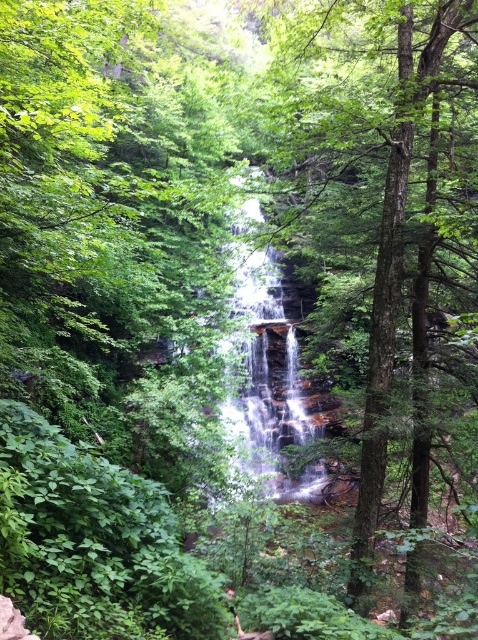
Between green rough bark tree at center and translucent glass waterfall at center, which one is positioned lower?

translucent glass waterfall at center is below.

Based on the photo, who is taller, green rough bark tree at center or translucent glass waterfall at center?

Standing taller between the two is green rough bark tree at center.

Does point (326, 317) come farther from viewer compared to point (279, 388)?

That is False.

Identify the location of green rough bark tree at center. pyautogui.click(x=373, y=227).